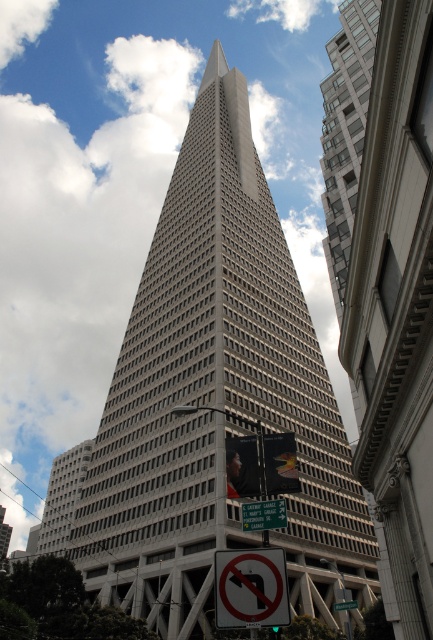
Question: Estimate the real-world distances between objects in this image. Which object is closer to the green plastic street sign at center?

Choices:
 (A) white plastic street sign at center
 (B) white plastic sign at lower center

Answer: (B)

Question: Observing the image, what is the correct spatial positioning of white plastic sign at lower center in reference to white plastic street sign at center?

Choices:
 (A) below
 (B) above

Answer: (B)

Question: Is green plastic street sign at center further to the viewer compared to white plastic street sign at center?

Choices:
 (A) yes
 (B) no

Answer: (B)

Question: From the image, what is the correct spatial relationship of white plastic sign at lower center in relation to green plastic street sign at center?

Choices:
 (A) left
 (B) right

Answer: (A)

Question: Which point is farther from the camera taking this photo?

Choices:
 (A) (351, 602)
 (B) (255, 563)

Answer: (A)

Question: Which point is closer to the camera taking this photo?

Choices:
 (A) (251, 520)
 (B) (268, 605)

Answer: (B)